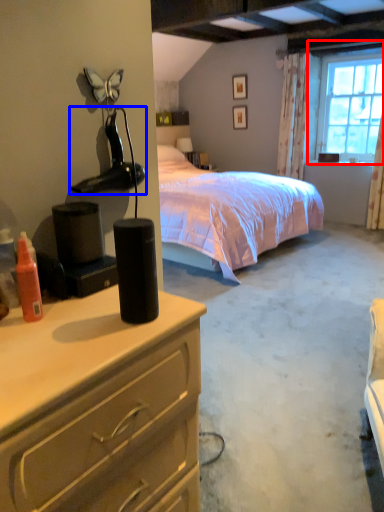
Question: Which object appears closest to the camera in this image, window (highlighted by a red box) or lamp (highlighted by a blue box)?

Choices:
 (A) window
 (B) lamp

Answer: (B)